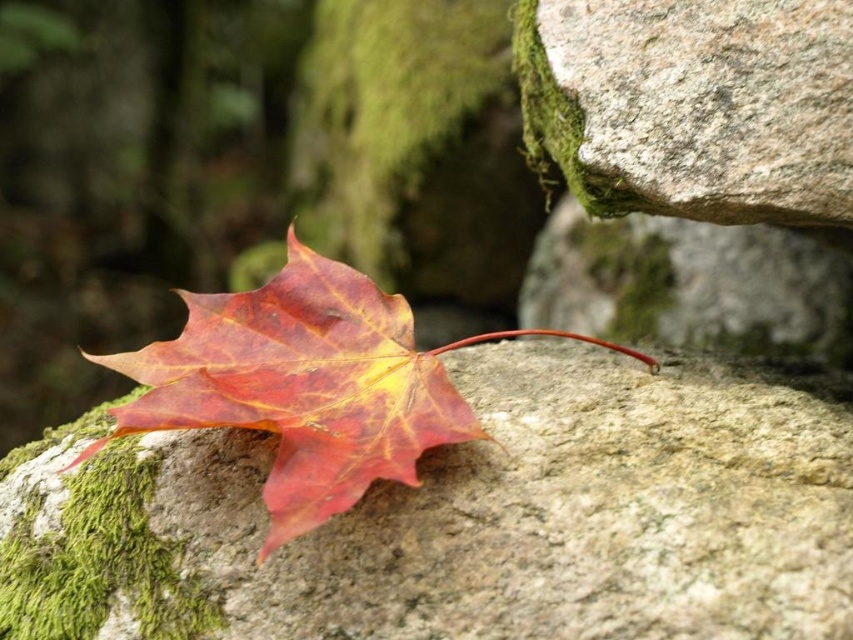
You are an artist sketching the scene and want to ensure the proportions are accurate. Which object is shorter in height between the shiny red maple leaf at center and the granite rock at upper right?

The shiny red maple leaf at center has a lesser height compared to the granite rock at upper right, so the shiny red maple leaf at center is shorter in height.

You are an artist sketching the scene and want to ensure proper perspective. Since you need to draw the shiny red maple leaf at center and the granite rock at upper right, which object should you place closer to the front of your drawing?

The shiny red maple leaf at center should be placed closer to the front of the drawing because it is closer to the viewer than the granite rock at upper right.

You are an artist sketching the scene and want to place the shiny red maple leaf at center and the granite rock at upper right accurately. According to the spatial arrangement, which object is positioned to the right side of the other?

The granite rock at upper right is positioned to the right of the shiny red maple leaf at center.